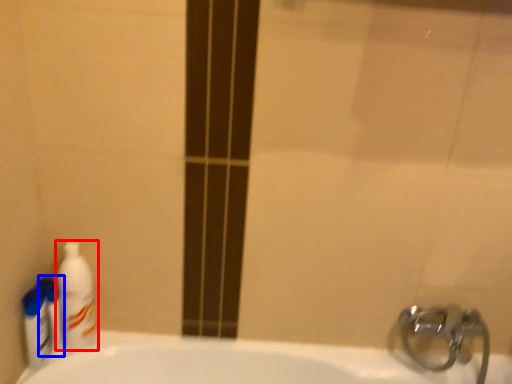
Question: Which object appears farthest to the camera in this image, cleaning product (highlighted by a red box) or mouthwash (highlighted by a blue box)?

Choices:
 (A) cleaning product
 (B) mouthwash

Answer: (B)